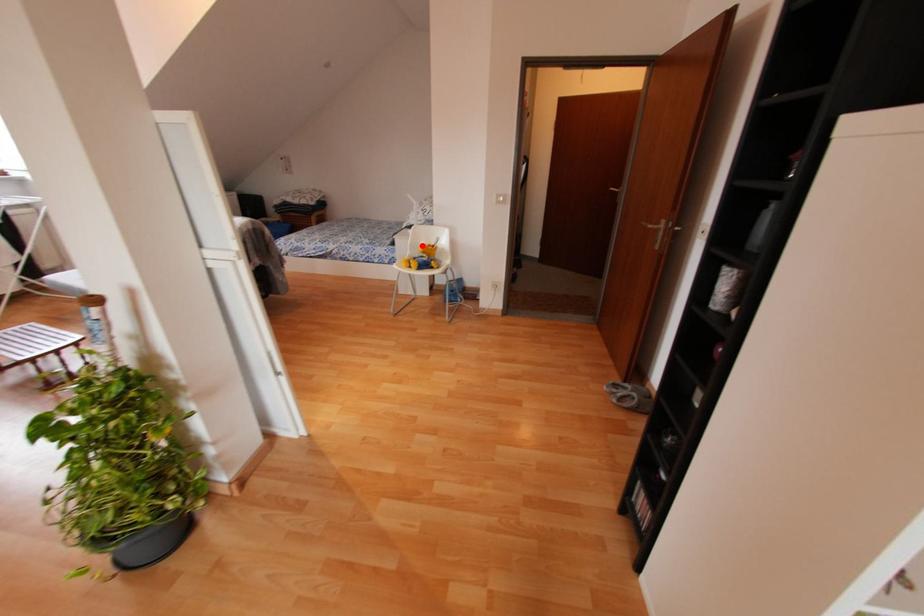
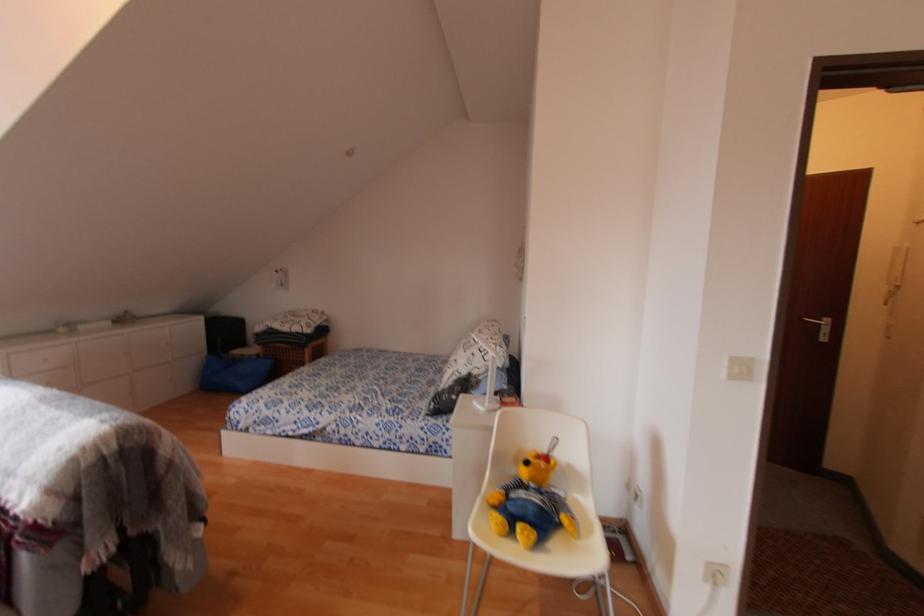
Where in the second image is the point corresponding to the highlighted location from the first image?

(527, 463)